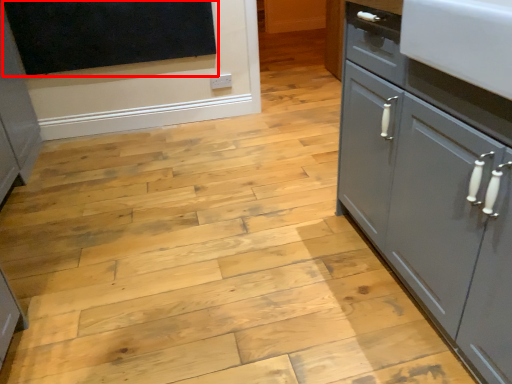
Question: From the image's perspective, where is dark (annotated by the red box) located in relation to cupboard in the image?

Choices:
 (A) below
 (B) above

Answer: (B)